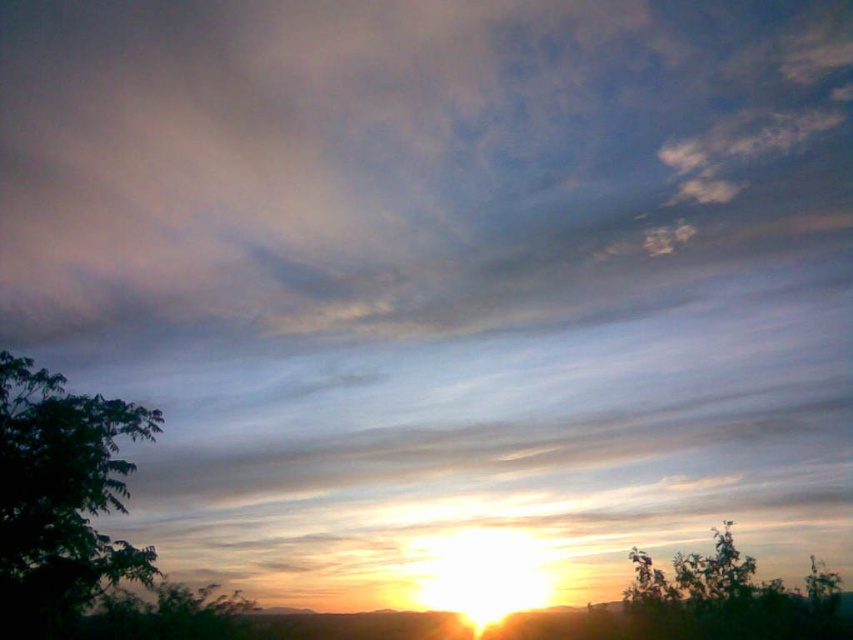
Who is positioned more to the left, green leafy tree at left or green leafy tree at lower right?

green leafy tree at left

Can you confirm if green leafy tree at left is shorter than green leafy tree at lower right?

Indeed, green leafy tree at left has a lesser height compared to green leafy tree at lower right.

Locate an element on the screen. The width and height of the screenshot is (853, 640). green leafy tree at left is located at coordinates click(61, 497).